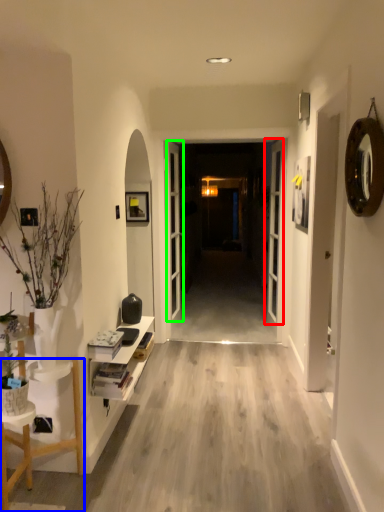
Question: Which object is positioned farthest from door (highlighted by a red box)? Select from furniture (highlighted by a blue box) and door (highlighted by a green box).

Choices:
 (A) furniture
 (B) door

Answer: (A)